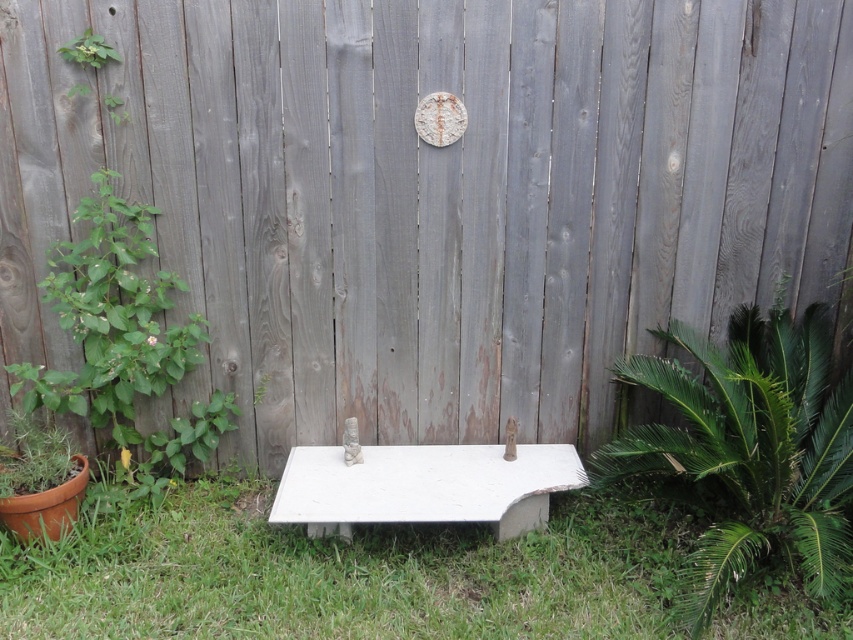
You are planning to place a new small flower pot between the green leafy plant at lower right and the green leafy plant at upper left. Based on their widths, which side should you place it closer to ensure it fits better?

The green leafy plant at lower right might be wider than the green leafy plant at upper left, so placing the flower pot closer to the upper left plant would leave more space on the wider side of the lower right plant, ensuring better fit.

You are a gardener who wants to place a new flower pot between the green grass at lower center and the white concrete bench at center. The flower pot is 10 inches wide. Is there enough space to place it there without touching either the grass or the bench?

The distance between the green grass at lower center and the white concrete bench at center is 9.54 inches. Since the flower pot is 10 inches wide, it would not fit without overlapping either the grass or the bench.